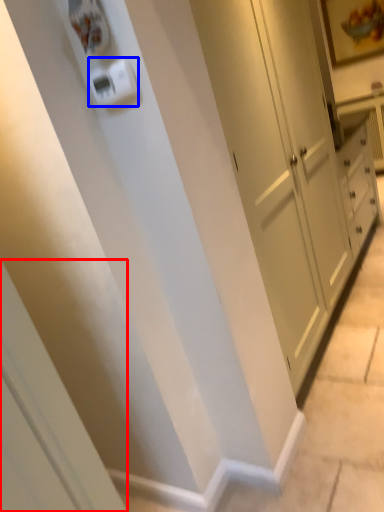
Question: Among these objects, which one is nearest to the camera, screen door (highlighted by a red box) or light switch (highlighted by a blue box)?

Choices:
 (A) screen door
 (B) light switch

Answer: (A)